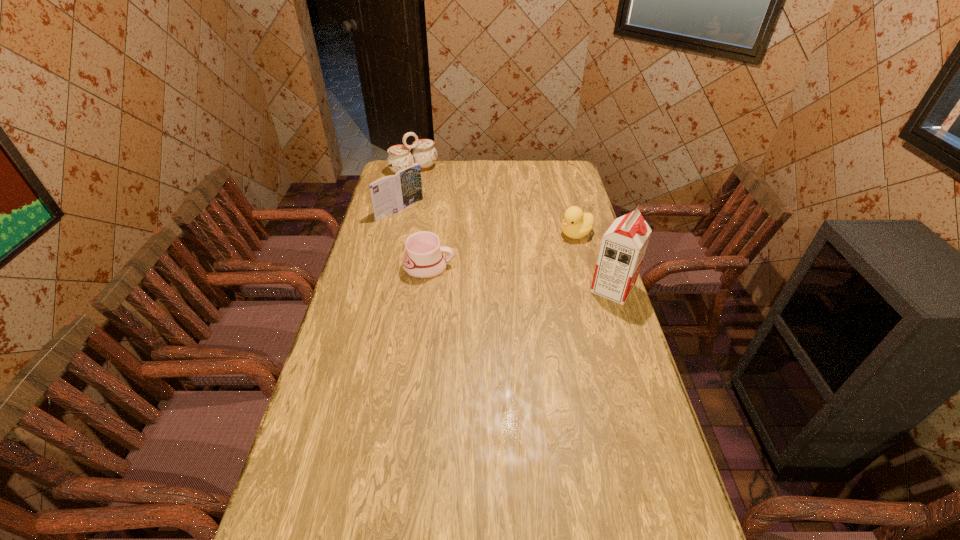
Find the location of a particular element. vacant area situated on the front-facing side of the third nearest object is located at coordinates (530, 258).

What are the coordinates of `vacant region located on the front cover of the fourth nearest object` in the screenshot? It's located at (426, 228).

Locate an element on the screen. vacant region located on the front cover of the fourth nearest object is located at coordinates (469, 256).

Image resolution: width=960 pixels, height=540 pixels. I want to click on vacant region located 0.210m on the front cover of the fourth nearest object, so click(x=445, y=240).

At what (x,y) coordinates should I click in order to perform the action: click on blank area located by the handle of the chinaware. Please return your answer as a coordinate pair (x, y). The width and height of the screenshot is (960, 540). Looking at the image, I should click on (448, 203).

Where is `blank space located by the handle of the chinaware`? The image size is (960, 540). blank space located by the handle of the chinaware is located at coordinates (449, 204).

The height and width of the screenshot is (540, 960). I want to click on free space located 0.200m by the handle of the chinaware, so click(x=443, y=197).

At what (x,y) coordinates should I click in order to perform the action: click on object located in the far edge section of the desktop. Please return your answer as a coordinate pair (x, y). Looking at the image, I should click on (424, 153).

Find the location of a particular element. The width and height of the screenshot is (960, 540). book situated at the left edge is located at coordinates (390, 194).

The height and width of the screenshot is (540, 960). Find the location of `chinaware that is at the left edge`. chinaware that is at the left edge is located at coordinates (424, 153).